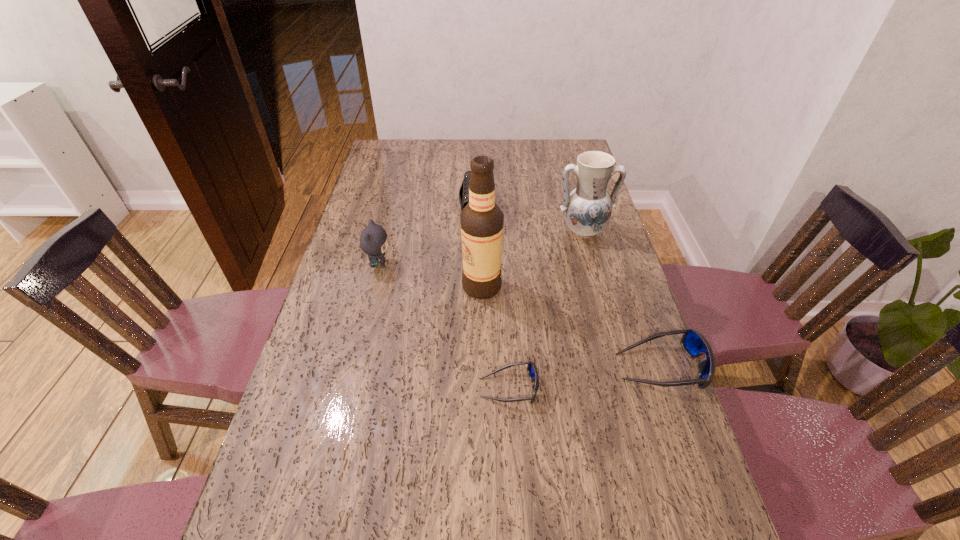
This screenshot has height=540, width=960. In order to click on free spot between the shorter sunglasses and the fifth tallest object in this screenshot , I will do `click(585, 377)`.

Select which object appears as the second closest to the right sunglasses. Please provide its 2D coordinates. Your answer should be formatted as a tuple, i.e. [(x, y)], where the tuple contains the x and y coordinates of a point satisfying the conditions above.

[(481, 220)]

I want to click on object that stands as the fifth closest to the fifth tallest object, so click(x=373, y=240).

Locate an element on the screen. free location that satisfies the following two spatial constraints: 1. on either side of the fifth shortest object; 2. on the front-facing side of the shorter sunglasses is located at coordinates (625, 388).

Locate an element on the screen. This screenshot has height=540, width=960. vacant space that satisfies the following two spatial constraints: 1. on either side of the second tallest object; 2. on the label of the tallest object is located at coordinates (598, 287).

This screenshot has width=960, height=540. Find the location of `vacant region that satisfies the following two spatial constraints: 1. on either side of the second tallest object; 2. on the front-facing side of the shorter sunglasses`. vacant region that satisfies the following two spatial constraints: 1. on either side of the second tallest object; 2. on the front-facing side of the shorter sunglasses is located at coordinates (625, 388).